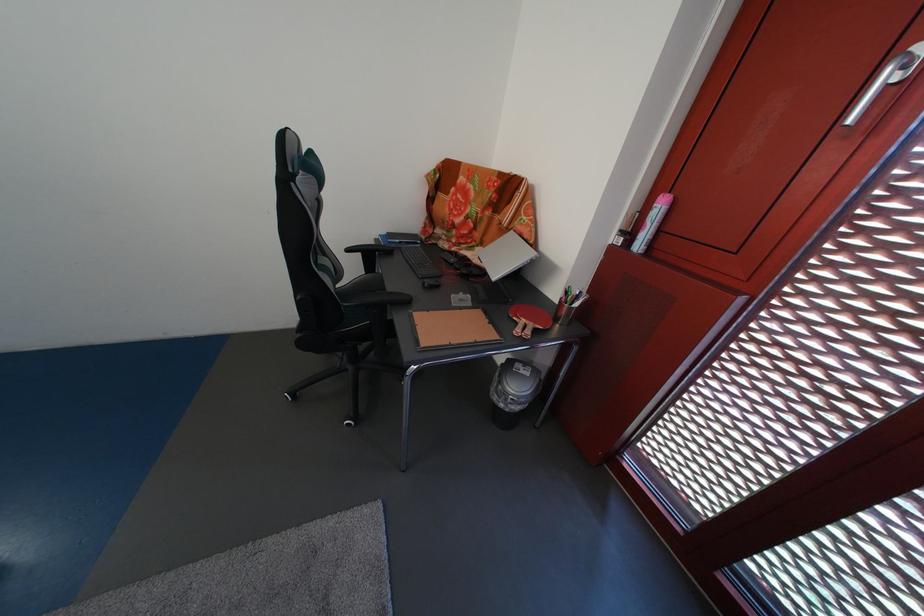
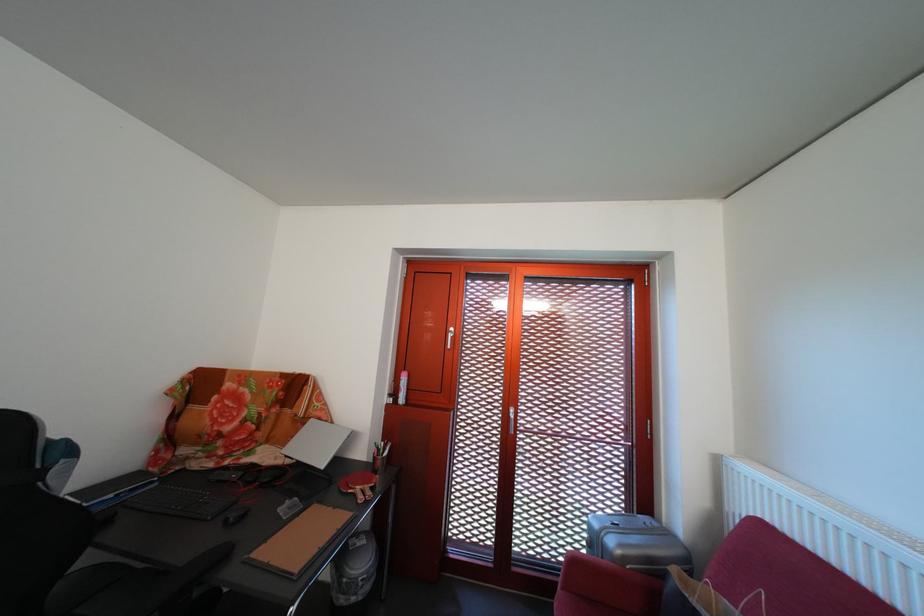
How did the camera likely rotate?

The rotation direction of the camera is right-up.